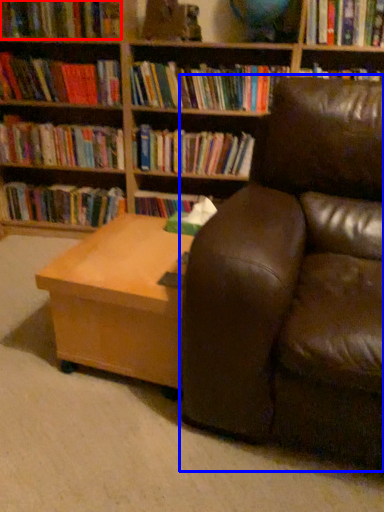
Question: Which point is closer to the camera, book (highlighted by a red box) or studio couch (highlighted by a blue box)?

Choices:
 (A) book
 (B) studio couch

Answer: (B)